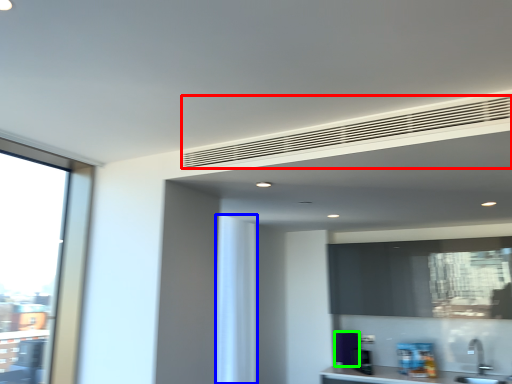
Question: Considering the real-world distances, which object is closest to blind (highlighted by a red box)? curtain (highlighted by a blue box) or appliance (highlighted by a green box).

Choices:
 (A) curtain
 (B) appliance

Answer: (A)